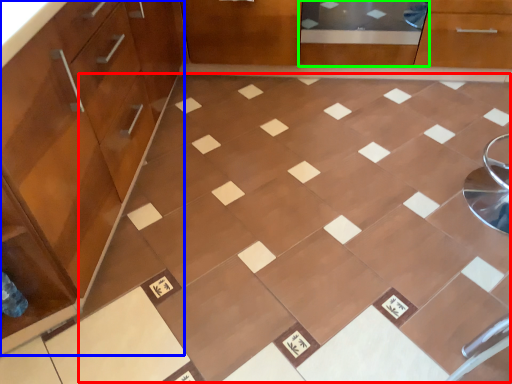
Question: Based on their relative distances, which object is nearer to ceramic tile (highlighted by a red box)? Choose from cabinetry (highlighted by a blue box) and screen door (highlighted by a green box).

Choices:
 (A) cabinetry
 (B) screen door

Answer: (A)